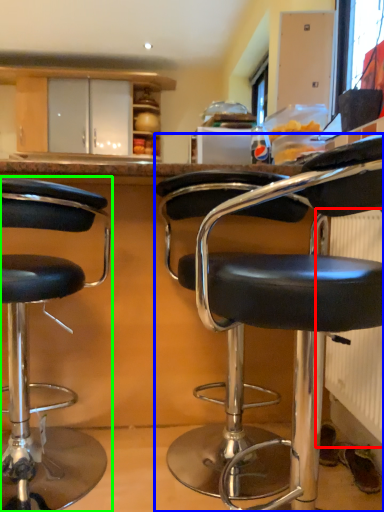
Question: Based on their relative distances, which object is nearer to radiator (highlighted by a red box)? Choose from chair (highlighted by a blue box) and chair (highlighted by a green box).

Choices:
 (A) chair
 (B) chair

Answer: (A)